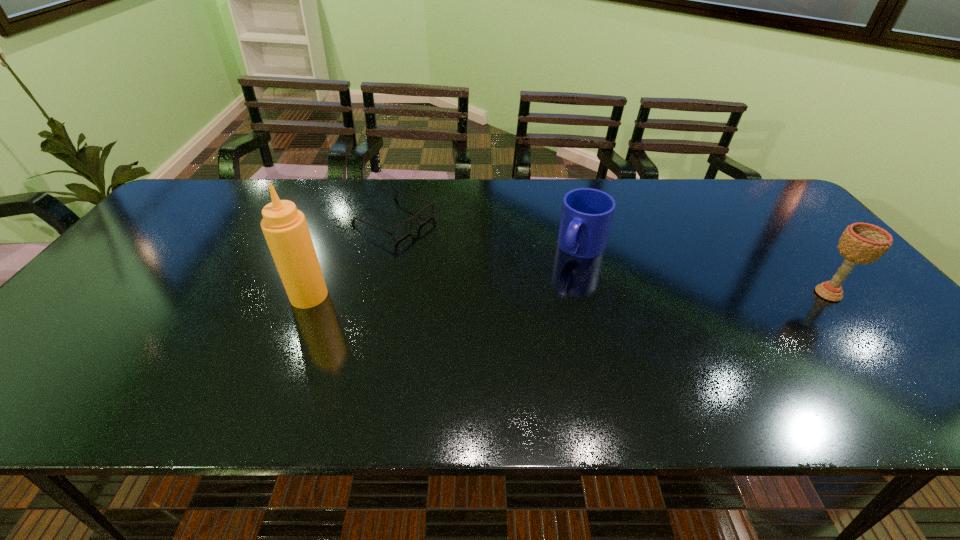
Where is `vacant region located on the side with the handle of the third object from left to right`? Image resolution: width=960 pixels, height=540 pixels. vacant region located on the side with the handle of the third object from left to right is located at coordinates (530, 328).

Find the location of a particular element. Image resolution: width=960 pixels, height=540 pixels. vacant space located on the front-facing side of the shortest object is located at coordinates (513, 273).

The width and height of the screenshot is (960, 540). I want to click on free spot located on the front-facing side of the shortest object, so click(461, 251).

You are a GUI agent. You are given a task and a screenshot of the screen. Output one action in this format:
    pyautogui.click(x=<x>, y=<y>)
    Task: Click on the free spot located 0.130m on the front-facing side of the shortest object
    The height and width of the screenshot is (540, 960).
    Given the screenshot: What is the action you would take?
    pyautogui.click(x=461, y=251)

This screenshot has width=960, height=540. What are the coordinates of `object that is positioned at the far edge` in the screenshot? It's located at (392, 233).

This screenshot has width=960, height=540. In order to click on object present at the right edge in this screenshot , I will do `click(861, 243)`.

You are a GUI agent. You are given a task and a screenshot of the screen. Output one action in this format:
    pyautogui.click(x=<x>, y=<y>)
    Task: Click on the free space at the far edge of the desktop
    Image resolution: width=960 pixels, height=540 pixels.
    Given the screenshot: What is the action you would take?
    pyautogui.click(x=623, y=179)

The height and width of the screenshot is (540, 960). What are the coordinates of `vacant space at the near edge of the desktop` in the screenshot? It's located at (315, 364).

Image resolution: width=960 pixels, height=540 pixels. Identify the location of free space at the left edge of the desktop. (87, 322).

At what (x,y) coordinates should I click in order to perform the action: click on free space at the right edge of the desktop. Please return your answer as a coordinate pair (x, y). The width and height of the screenshot is (960, 540). Looking at the image, I should click on (851, 335).